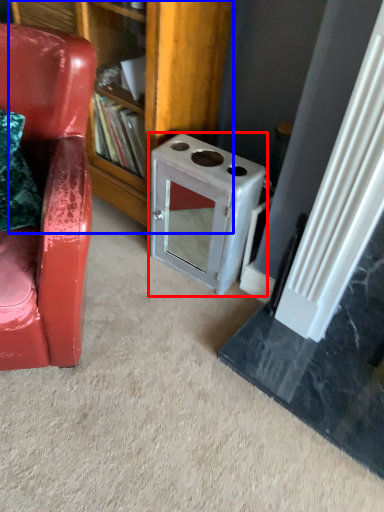
Question: Which of the following is the farthest to the observer, appliance (highlighted by a red box) or bookshelf (highlighted by a blue box)?

Choices:
 (A) appliance
 (B) bookshelf

Answer: (A)